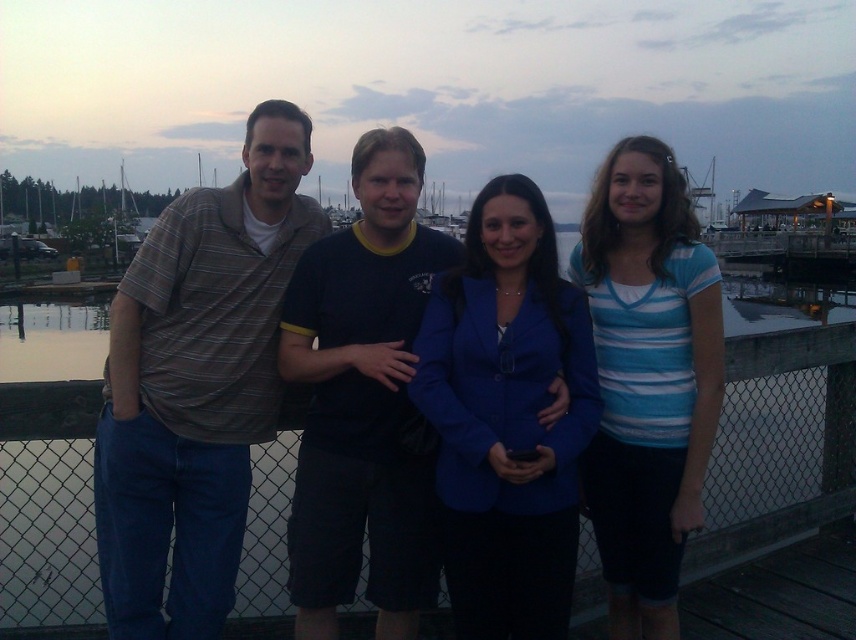
Who is higher up, blue fabric jacket at center or dark blue t-shirt at center?

dark blue t-shirt at center is above.

Where is `blue fabric jacket at center`? blue fabric jacket at center is located at coordinates (507, 417).

Locate an element on the screen. This screenshot has width=856, height=640. blue fabric jacket at center is located at coordinates (507, 417).

Between dark blue t-shirt at center and blue striped shirt at center, which one appears on the left side from the viewer's perspective?

dark blue t-shirt at center is more to the left.

Does dark blue t-shirt at center appear under blue striped shirt at center?

Yes, dark blue t-shirt at center is below blue striped shirt at center.

I want to click on dark blue t-shirt at center, so click(x=363, y=401).

Image resolution: width=856 pixels, height=640 pixels. Find the location of `dark blue t-shirt at center`. dark blue t-shirt at center is located at coordinates (363, 401).

Is striped cotton shirt at left to the left of dark blue t-shirt at center from the viewer's perspective?

Indeed, striped cotton shirt at left is positioned on the left side of dark blue t-shirt at center.

Who is positioned more to the right, striped cotton shirt at left or dark blue t-shirt at center?

dark blue t-shirt at center

This screenshot has width=856, height=640. What do you see at coordinates (197, 385) in the screenshot? I see `striped cotton shirt at left` at bounding box center [197, 385].

At what (x,y) coordinates should I click in order to perform the action: click on striped cotton shirt at left. Please return your answer as a coordinate pair (x, y). Image resolution: width=856 pixels, height=640 pixels. Looking at the image, I should click on (197, 385).